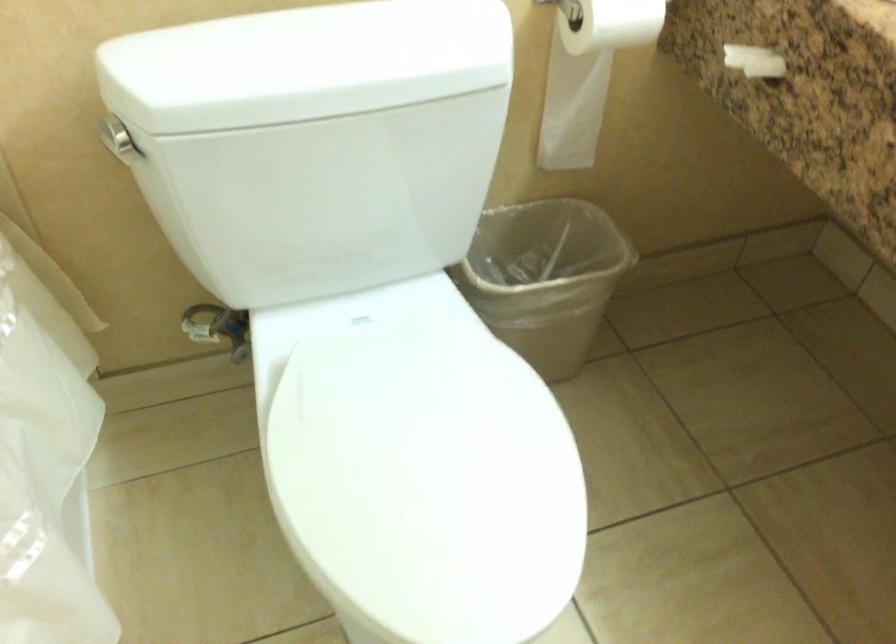
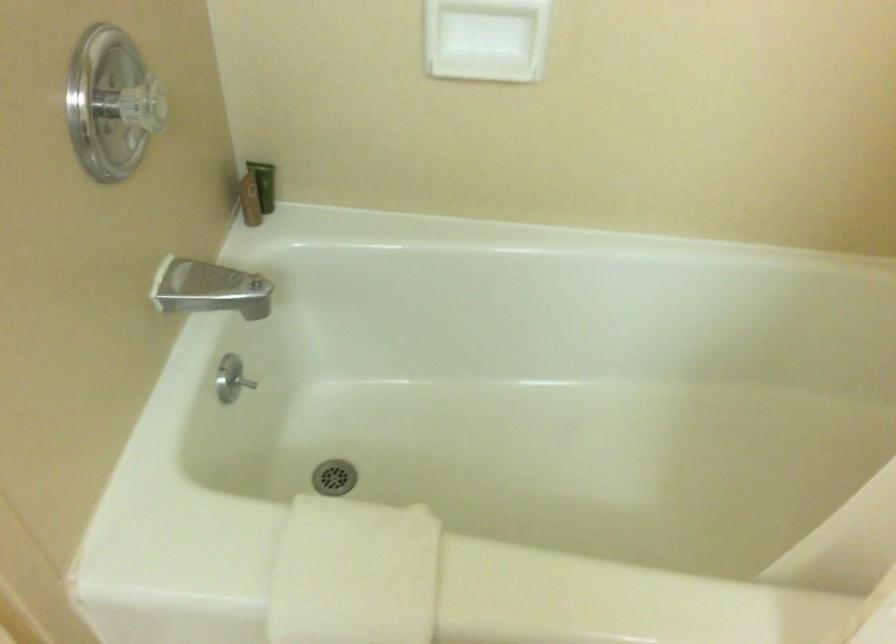
The first image is from the beginning of the video and the second image is from the end. How did the camera likely rotate when shooting the video?

The camera rotated toward left-down.